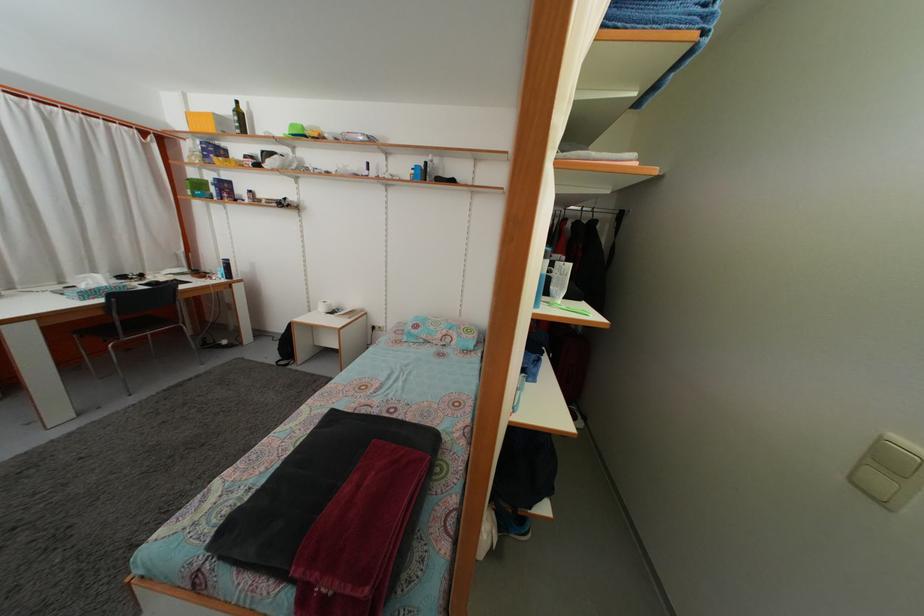
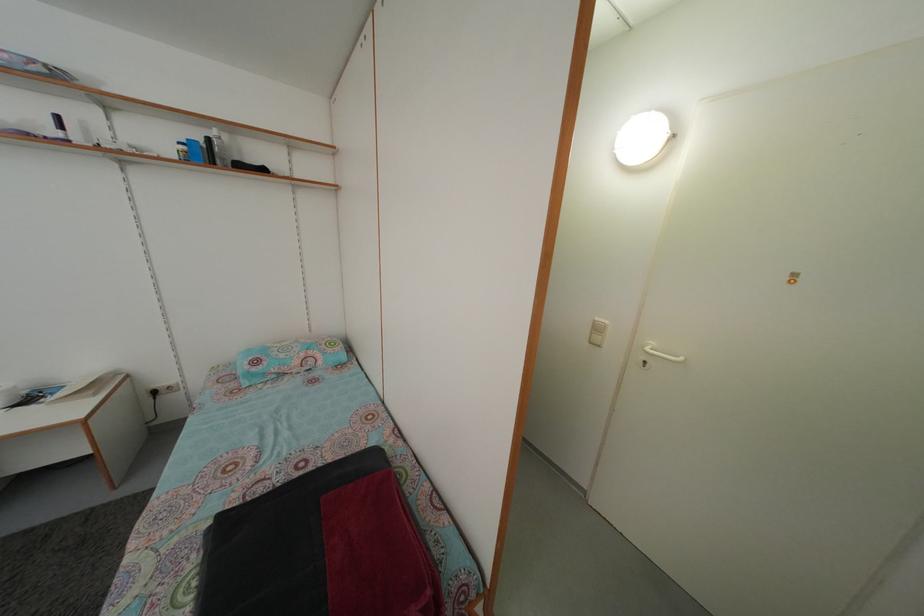
In the second image, find the point that corresponds to point (445, 182) in the first image.

(242, 166)